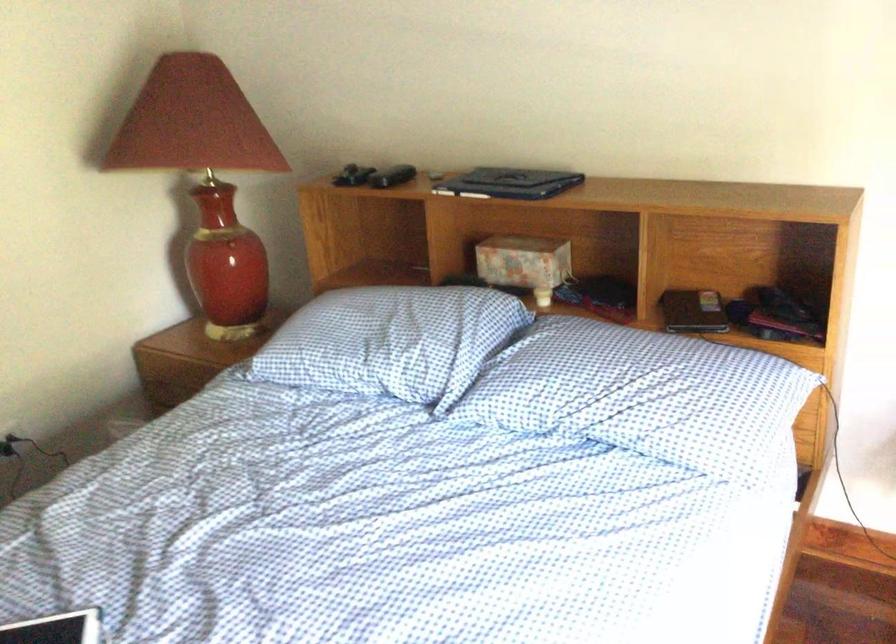
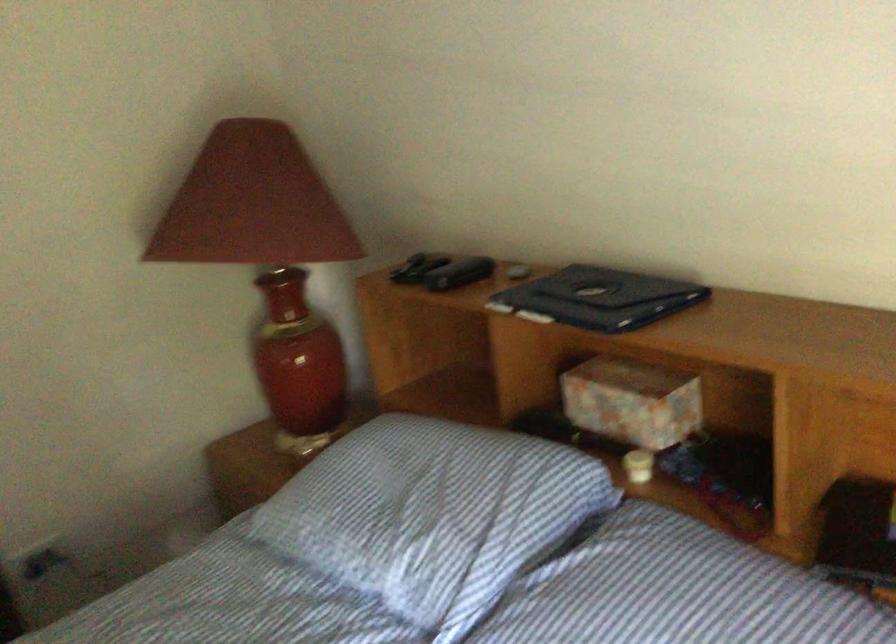
Consider the image. Which direction would the cameraman need to move to produce the second image?

The movement direction of the cameraman is right, forward.